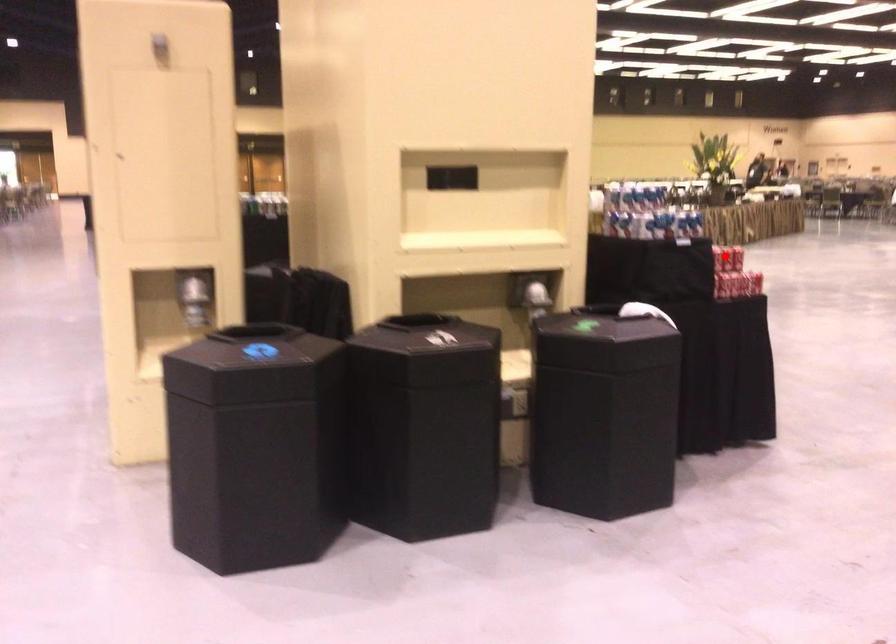
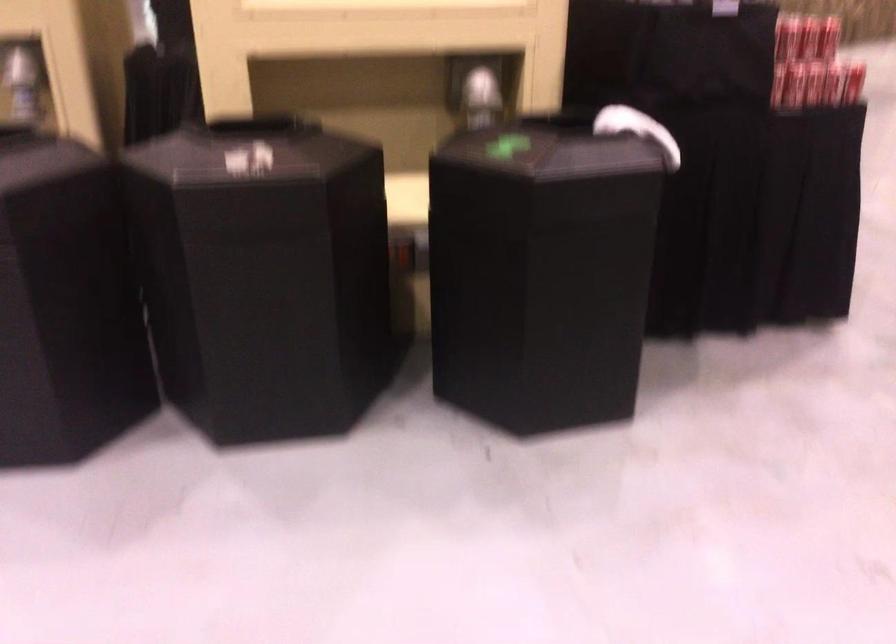
The point at the highlighted location is marked in the first image. Where is the corresponding point in the second image?

(787, 37)